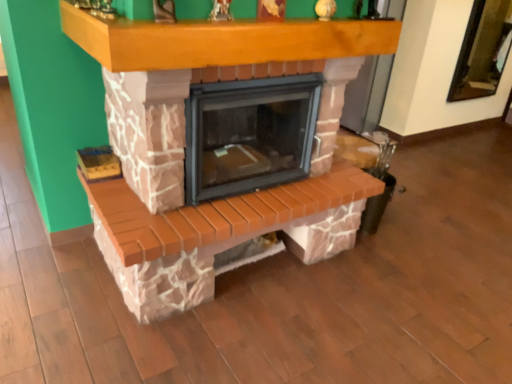
Question: Can you see brick fireplace at center touching wooden mantle at upper center?

Choices:
 (A) no
 (B) yes

Answer: (A)

Question: Would you say wooden mantle at upper center is part of brick fireplace at center's contents?

Choices:
 (A) yes
 (B) no

Answer: (B)

Question: Is brick fireplace at center further to the viewer compared to wooden mantle at upper center?

Choices:
 (A) yes
 (B) no

Answer: (A)

Question: From the image's perspective, does brick fireplace at center appear higher than wooden mantle at upper center?

Choices:
 (A) no
 (B) yes

Answer: (A)

Question: Can you confirm if brick fireplace at center is wider than wooden mantle at upper center?

Choices:
 (A) yes
 (B) no

Answer: (B)

Question: From the image's perspective, is brick fireplace at center below wooden mantle at upper center?

Choices:
 (A) yes
 (B) no

Answer: (A)

Question: Can you confirm if wooden mantle at upper center is taller than brick fireplace at center?

Choices:
 (A) yes
 (B) no

Answer: (B)

Question: From a real-world perspective, is wooden mantle at upper center positioned over brick fireplace at center based on gravity?

Choices:
 (A) no
 (B) yes

Answer: (B)

Question: Is wooden mantle at upper center outside brick fireplace at center?

Choices:
 (A) yes
 (B) no

Answer: (A)

Question: Can you confirm if wooden mantle at upper center is bigger than brick fireplace at center?

Choices:
 (A) no
 (B) yes

Answer: (A)

Question: Does wooden mantle at upper center touch brick fireplace at center?

Choices:
 (A) yes
 (B) no

Answer: (B)

Question: Are wooden mantle at upper center and brick fireplace at center located far from each other?

Choices:
 (A) no
 (B) yes

Answer: (A)

Question: Is brick fireplace at center inside the boundaries of wooden mantle at upper center, or outside?

Choices:
 (A) inside
 (B) outside

Answer: (B)